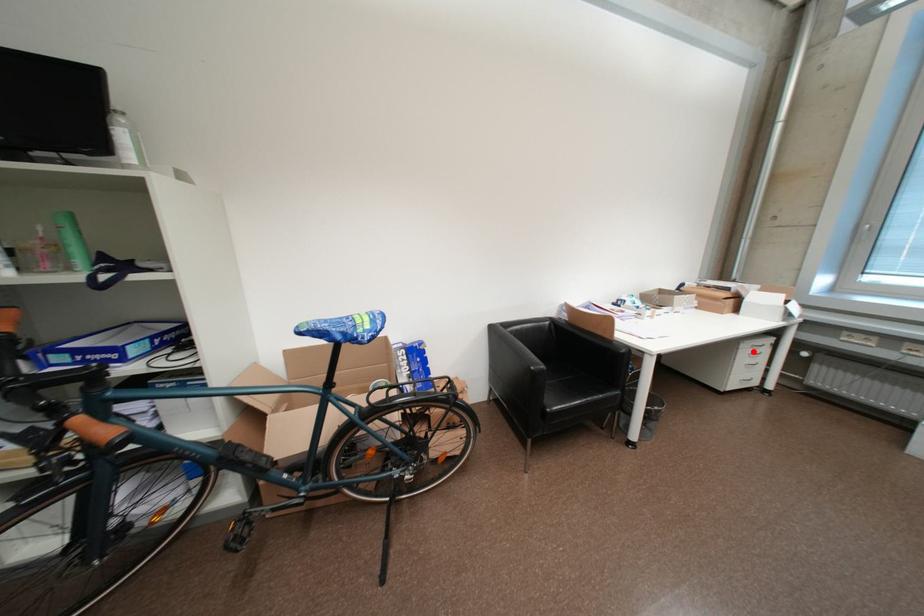
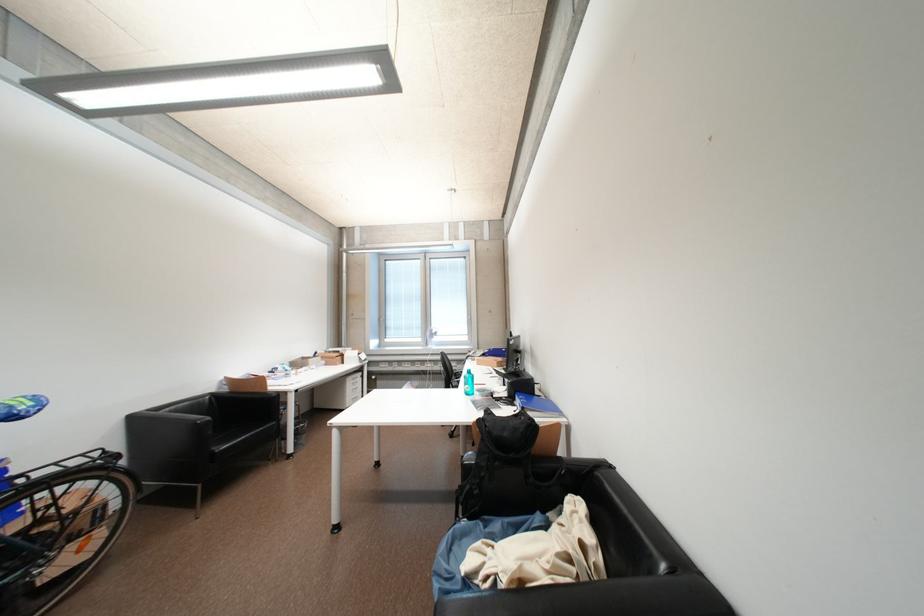
Find the pixel in the second image that matches the highlighted location in the first image.

(358, 384)